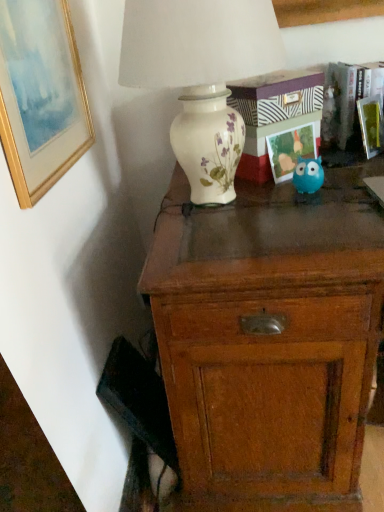
Locate an element on the screen. free spot above wooden chest of drawers at center (from a real-world perspective) is located at coordinates (283, 202).